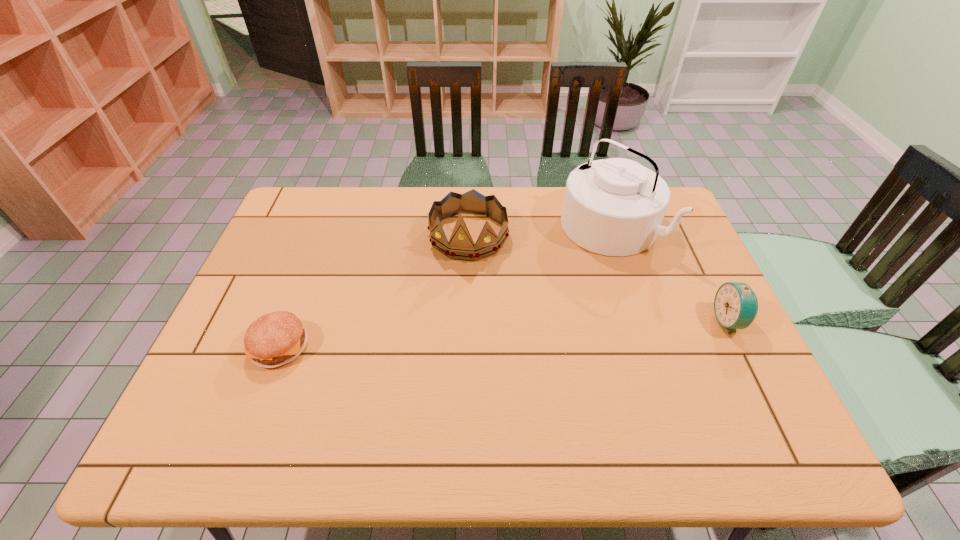
At what (x,y) coordinates should I click in order to perform the action: click on free space that is in between the tallest object and the alarm clock. Please return your answer as a coordinate pair (x, y). Looking at the image, I should click on (669, 274).

This screenshot has height=540, width=960. What are the coordinates of `free space between the leftmost object and the third tallest object` in the screenshot? It's located at (505, 333).

Locate an element on the screen. vacant area between the alarm clock and the tallest object is located at coordinates (669, 274).

In order to click on free space between the rightmost object and the tallest object in this screenshot , I will do `click(669, 274)`.

At what (x,y) coordinates should I click in order to perform the action: click on free space between the tiara and the second object from right to left. Please return your answer as a coordinate pair (x, y). The height and width of the screenshot is (540, 960). Looking at the image, I should click on (539, 232).

Where is `free space between the rightmost object and the shortest object`? The image size is (960, 540). free space between the rightmost object and the shortest object is located at coordinates (505, 333).

The width and height of the screenshot is (960, 540). I want to click on free spot between the rightmost object and the kettle, so click(669, 274).

At what (x,y) coordinates should I click in order to perform the action: click on unoccupied position between the tallest object and the rightmost object. Please return your answer as a coordinate pair (x, y). This screenshot has height=540, width=960. Looking at the image, I should click on (669, 274).

Image resolution: width=960 pixels, height=540 pixels. In order to click on vacant space in between the rightmost object and the leftmost object in this screenshot , I will do `click(505, 333)`.

Locate which object ranks third in proximity to the leftmost object. Please provide its 2D coordinates. Your answer should be formatted as a tuple, i.e. [(x, y)], where the tuple contains the x and y coordinates of a point satisfying the conditions above.

[(735, 305)]